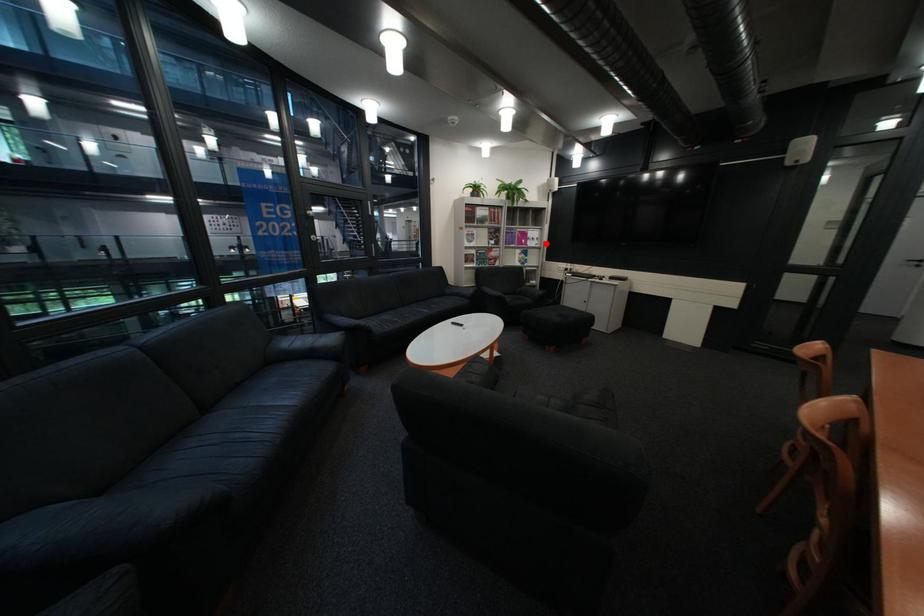
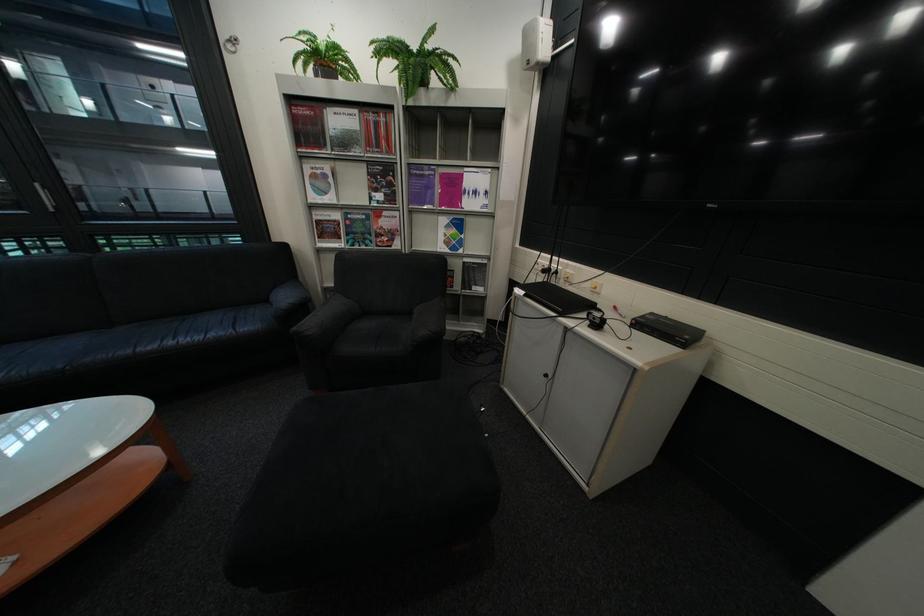
The point at the highlighted location is marked in the first image. Where is the corresponding point in the second image?

(484, 204)